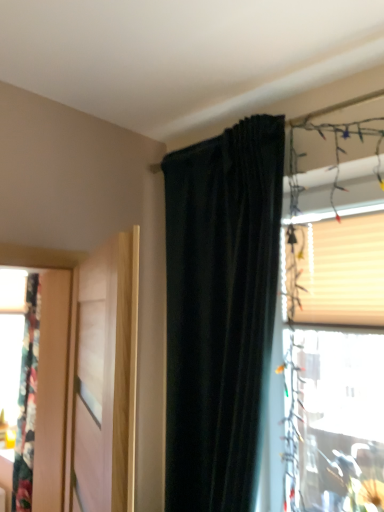
What do you see at coordinates (220, 311) in the screenshot?
I see `dark velvet curtain at upper center` at bounding box center [220, 311].

Describe the element at coordinates (103, 379) in the screenshot. I see `light wood door at left` at that location.

Describe the element at coordinates (343, 272) in the screenshot. I see `beige textured blind at upper right` at that location.

This screenshot has width=384, height=512. I want to click on dark velvet curtain at upper center, so coord(220,311).

Between light wood door at left and dark velvet curtain at upper center, which one is positioned behind?

dark velvet curtain at upper center is further from the camera.

From the picture: Is light wood door at left situated inside dark velvet curtain at upper center or outside?

light wood door at left is located beyond the bounds of dark velvet curtain at upper center.

In the scene shown: Who is smaller, light wood door at left or dark velvet curtain at upper center?

Smaller between the two is light wood door at left.

From the image's perspective, is beige textured blind at upper right over dark velvet curtain at upper center?

Yes, from the image's perspective, beige textured blind at upper right is above dark velvet curtain at upper center.

Which of these two, beige textured blind at upper right or dark velvet curtain at upper center, is thinner?

Thinner between the two is beige textured blind at upper right.

Considering the relative sizes of beige textured blind at upper right and dark velvet curtain at upper center in the image provided, is beige textured blind at upper right taller than dark velvet curtain at upper center?

In fact, beige textured blind at upper right may be shorter than dark velvet curtain at upper center.

Is point (300, 417) behind point (105, 283)?

Yes, point (300, 417) is farther from viewer.

Is translucent plastic window at upper right further to camera compared to light wood door at left?

Yes, it is.

Is translucent plastic window at upper right to the left of light wood door at left from the viewer's perspective?

Incorrect, translucent plastic window at upper right is not on the left side of light wood door at left.

Could dark velvet curtain at upper center be considered to be inside translucent plastic window at upper right?

No, translucent plastic window at upper right does not contain dark velvet curtain at upper center.

Considering the sizes of translucent plastic window at upper right and dark velvet curtain at upper center in the image, is translucent plastic window at upper right bigger or smaller than dark velvet curtain at upper center?

Considering their sizes, translucent plastic window at upper right takes up less space than dark velvet curtain at upper center.

Does translucent plastic window at upper right have a lesser height compared to dark velvet curtain at upper center?

Correct, translucent plastic window at upper right is not as tall as dark velvet curtain at upper center.

Is dark velvet curtain at upper center at the back of translucent plastic window at upper right?

No, translucent plastic window at upper right is not facing the opposite direction of dark velvet curtain at upper center.

Considering the sizes of objects beige textured blind at upper right and translucent plastic window at upper right in the image provided, who is thinner, beige textured blind at upper right or translucent plastic window at upper right?

Thinner between the two is translucent plastic window at upper right.

From the image's perspective, is beige textured blind at upper right on translucent plastic window at upper right?

Yes.

Is translucent plastic window at upper right at the back of beige textured blind at upper right?

No, beige textured blind at upper right is not facing the opposite direction of translucent plastic window at upper right.

Considering the relative positions of beige textured blind at upper right and translucent plastic window at upper right in the image provided, is beige textured blind at upper right in front of translucent plastic window at upper right?

No, beige textured blind at upper right is further to the viewer.

Is dark velvet curtain at upper center inside the boundaries of beige textured blind at upper right, or outside?

dark velvet curtain at upper center is located beyond the bounds of beige textured blind at upper right.

Which of these two, dark velvet curtain at upper center or beige textured blind at upper right, is smaller?

beige textured blind at upper right is smaller.

Is dark velvet curtain at upper center facing towards beige textured blind at upper right?

No, dark velvet curtain at upper center is not facing towards beige textured blind at upper right.

Does dark velvet curtain at upper center have a larger size compared to light wood door at left?

Yes.

Is dark velvet curtain at upper center facing away from light wood door at left?

Correct, dark velvet curtain at upper center is looking away from light wood door at left.

Between dark velvet curtain at upper center and light wood door at left, which one is positioned behind?

dark velvet curtain at upper center is behind.

Image resolution: width=384 pixels, height=512 pixels. In order to click on door that appears on the left of dark velvet curtain at upper center in this screenshot , I will do `click(103, 379)`.

What are the coordinates of `blind on the right of dark velvet curtain at upper center` in the screenshot? It's located at (343, 272).

Estimate the real-world distances between objects in this image. Which object is further from light wood door at left, beige textured blind at upper right or translucent plastic window at upper right?

beige textured blind at upper right is further to light wood door at left.

Considering their positions, is beige textured blind at upper right positioned further to dark velvet curtain at upper center than translucent plastic window at upper right?

translucent plastic window at upper right is further to dark velvet curtain at upper center.

From the picture: Which object lies nearer to the anchor point light wood door at left, translucent plastic window at upper right or dark velvet curtain at upper center?

Based on the image, dark velvet curtain at upper center appears to be nearer to light wood door at left.

When comparing their distances from dark velvet curtain at upper center, does beige textured blind at upper right or light wood door at left seem further?

The object further to dark velvet curtain at upper center is light wood door at left.

When comparing their distances from translucent plastic window at upper right, does dark velvet curtain at upper center or beige textured blind at upper right seem further?

The object further to translucent plastic window at upper right is dark velvet curtain at upper center.

Based on the photo, which object lies further to the anchor point dark velvet curtain at upper center, light wood door at left or beige textured blind at upper right?

Among the two, light wood door at left is located further to dark velvet curtain at upper center.

Based on their spatial positions, is light wood door at left or dark velvet curtain at upper center further from translucent plastic window at upper right?

light wood door at left is further to translucent plastic window at upper right.

Looking at the image, which one is located closer to dark velvet curtain at upper center, translucent plastic window at upper right or beige textured blind at upper right?

Based on the image, beige textured blind at upper right appears to be nearer to dark velvet curtain at upper center.

Locate an element on the screen. curtain between light wood door at left and beige textured blind at upper right from left to right is located at coordinates (220, 311).

This screenshot has height=512, width=384. Identify the location of window located between dark velvet curtain at upper center and beige textured blind at upper right in the left-right direction. [x=334, y=365].

This screenshot has height=512, width=384. What are the coordinates of `window between light wood door at left and beige textured blind at upper right` in the screenshot? It's located at (334, 365).

I want to click on curtain between light wood door at left and translucent plastic window at upper right, so click(x=220, y=311).